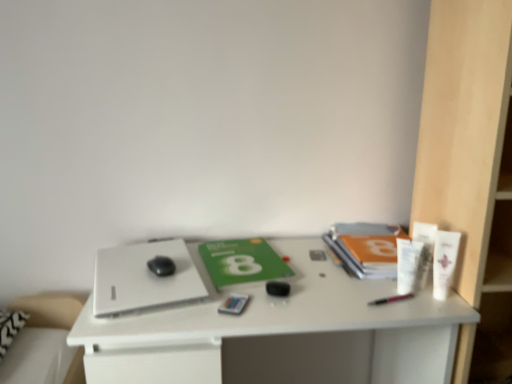
The image size is (512, 384). Identify the location of empty space that is ontop of white matte desk at center. (279, 274).